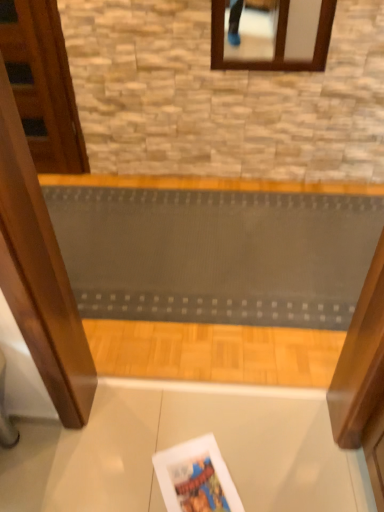
Question: Is matte paper magazine at lower center aimed at textured gray ramp at center?

Choices:
 (A) no
 (B) yes

Answer: (A)

Question: Is matte paper magazine at lower center taller than textured gray ramp at center?

Choices:
 (A) no
 (B) yes

Answer: (A)

Question: Is matte paper magazine at lower center turned away from textured gray ramp at center?

Choices:
 (A) no
 (B) yes

Answer: (A)

Question: From the image's perspective, would you say matte paper magazine at lower center is shown under textured gray ramp at center?

Choices:
 (A) yes
 (B) no

Answer: (A)

Question: From the image's perspective, is matte paper magazine at lower center above textured gray ramp at center?

Choices:
 (A) no
 (B) yes

Answer: (A)

Question: Does matte paper magazine at lower center have a smaller size compared to textured gray ramp at center?

Choices:
 (A) no
 (B) yes

Answer: (B)

Question: Can you confirm if textured gray ramp at center is thinner than wooden door at left?

Choices:
 (A) no
 (B) yes

Answer: (A)

Question: From a real-world perspective, is textured gray ramp at center physically below wooden door at left?

Choices:
 (A) yes
 (B) no

Answer: (A)

Question: Does textured gray ramp at center come in front of wooden door at left?

Choices:
 (A) yes
 (B) no

Answer: (A)

Question: From the image's perspective, is textured gray ramp at center below wooden door at left?

Choices:
 (A) no
 (B) yes

Answer: (B)

Question: Is textured gray ramp at center bigger than wooden door at left?

Choices:
 (A) yes
 (B) no

Answer: (A)

Question: Considering the relative sizes of textured gray ramp at center and wooden door at left in the image provided, is textured gray ramp at center taller than wooden door at left?

Choices:
 (A) no
 (B) yes

Answer: (A)

Question: Is textured gray ramp at center not within matte paper magazine at lower center?

Choices:
 (A) yes
 (B) no

Answer: (A)